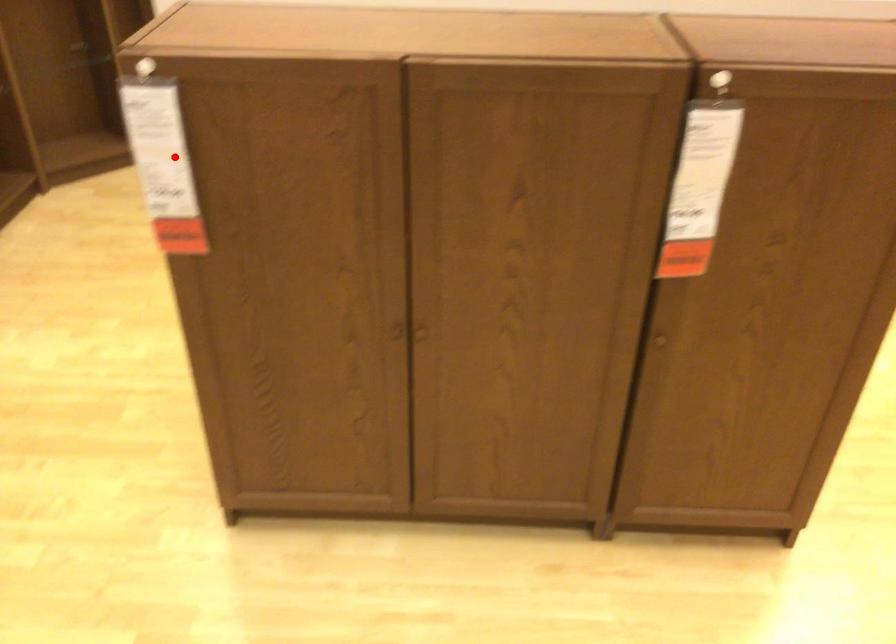
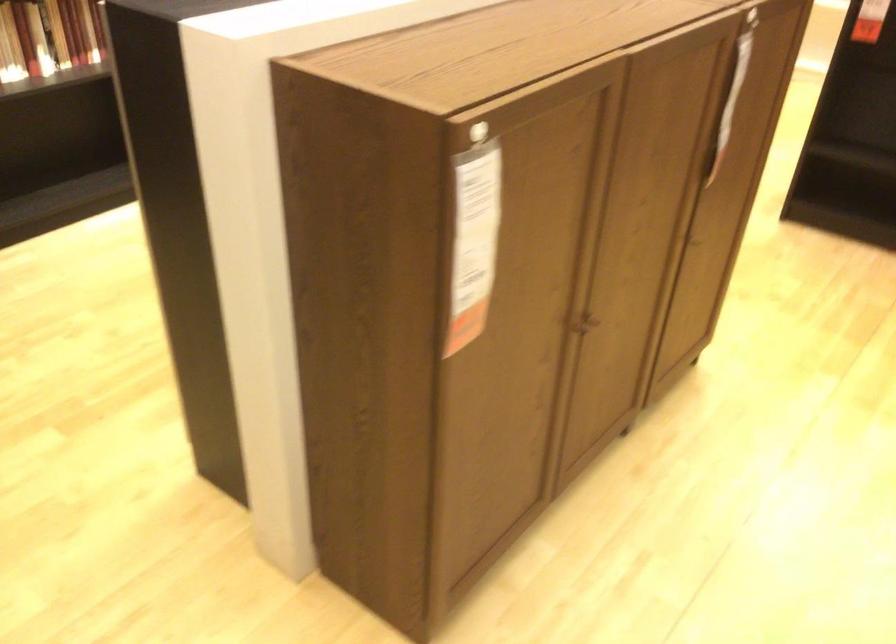
Where in the second image is the point corresponding to the highlighted location from the first image?

(474, 242)